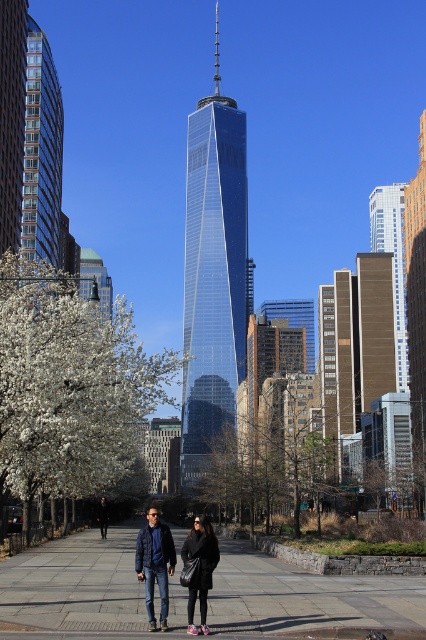
You are a delivery person standing at the black leather jacket at center and need to place a package on the gray concrete pavement at center. Can you reach the pavement without moving from your current position?

The gray concrete pavement at center and black leather jacket at center are 20.72 meters apart, so you cannot reach the gray concrete pavement at center from your current position without moving.

Based on the photo, you are standing at the point labeled as point (187, 595) in the image. What is the name of the surface you are currently standing on?

The surface you are standing on is the gray concrete pavement at center, which is represented by point (187, 595).